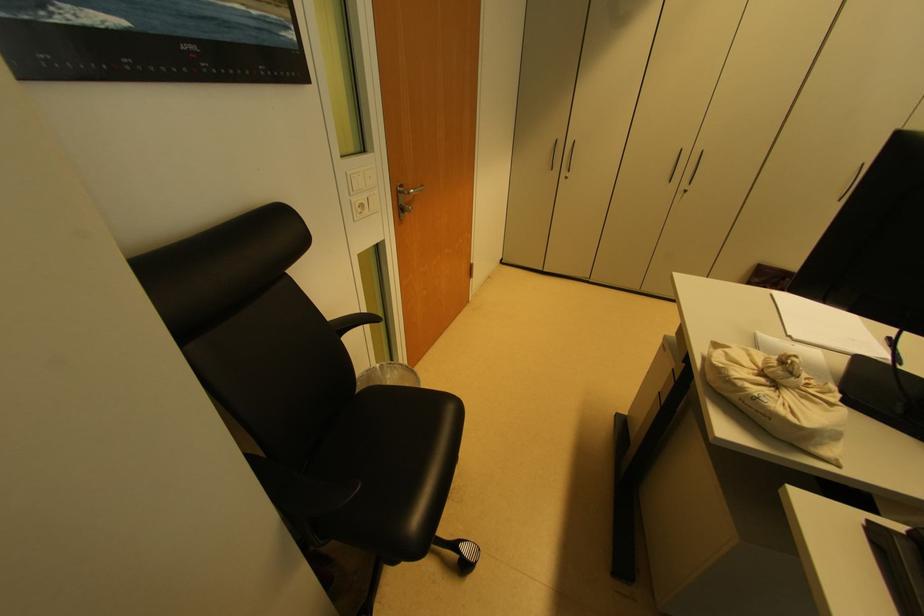
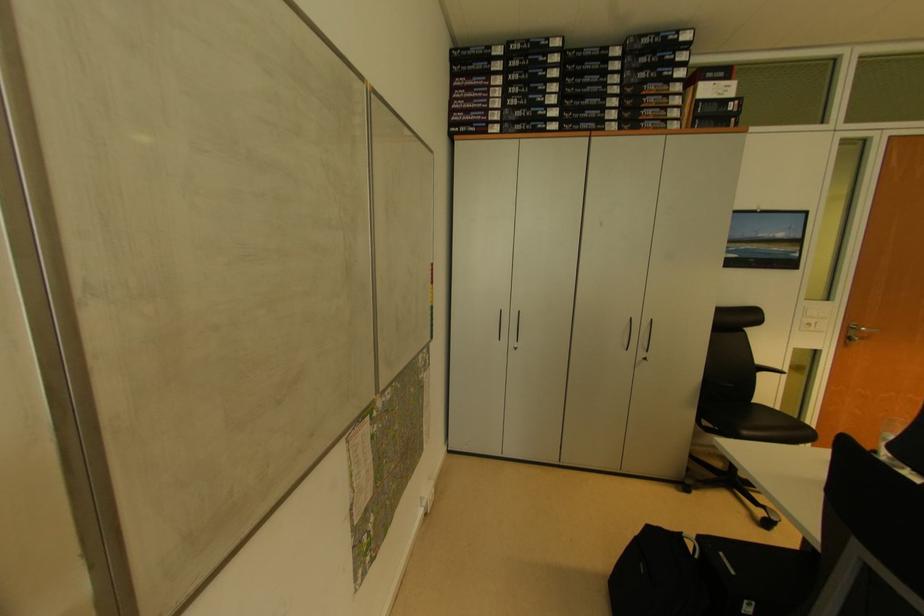
Where in the second image is the point corresponding to point (363, 209) from the first image?

(811, 328)